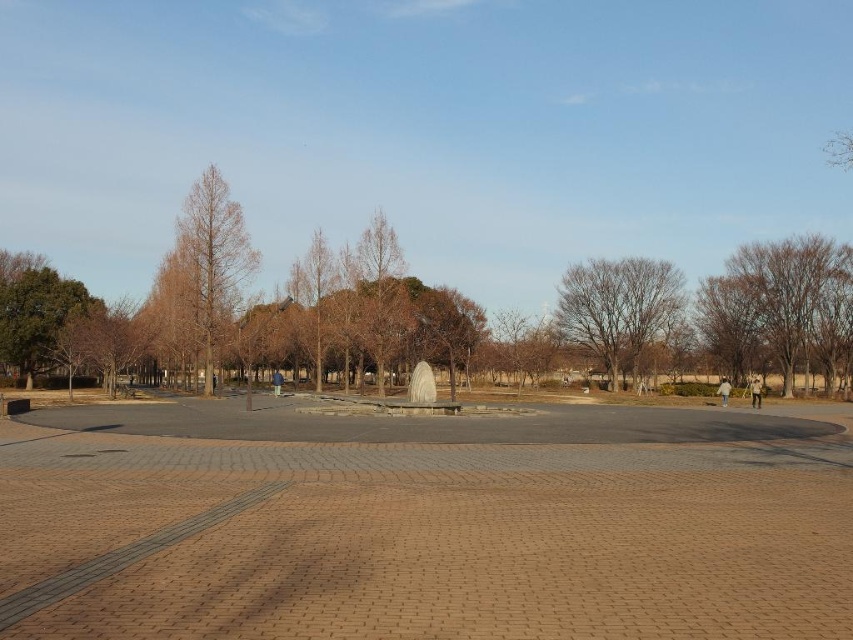
You are standing in the park and want to take a photo of both the brown leafless tree at center and the brown matte tree at center. Which tree should you focus on first to ensure both are in the frame?

You should focus on the brown leafless tree at center first because it is closer to you than the brown matte tree at center, so adjusting the camera to include it will also capture the farther tree if they are aligned.

You are standing at the entrance of the park and want to find the brown leafless tree at center. According to the coordinates provided, where should you look relative to your current position?

The brown leafless tree at center is located at coordinates point (618, 308), which means it is positioned slightly to the right and above your current position at the entrance.

You are standing at point (618, 308) in the park. What do you see directly in front of you?

You see a brown leafless tree at center directly in front of you at point (618, 308).